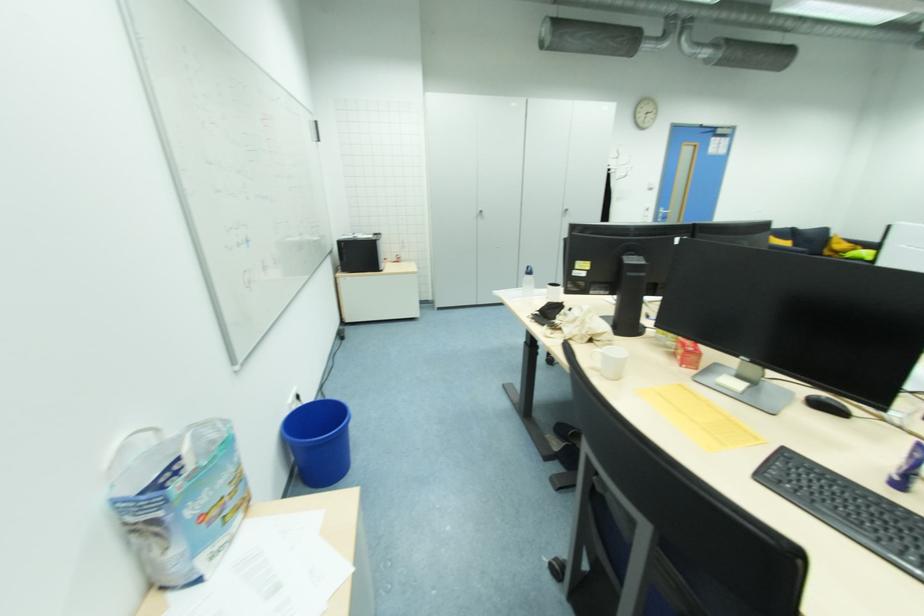
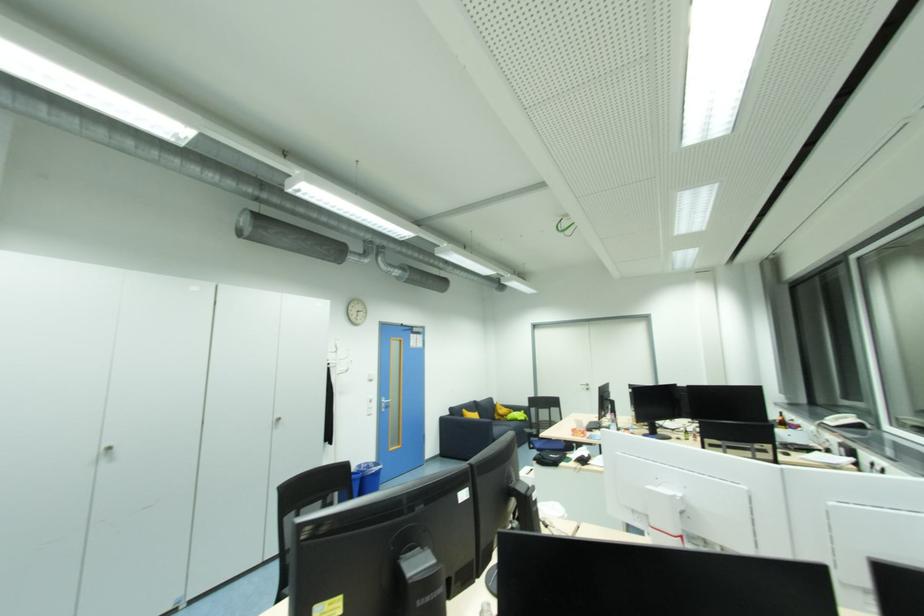
In the second image, find the point that corresponds to (484,214) in the first image.

(113, 448)